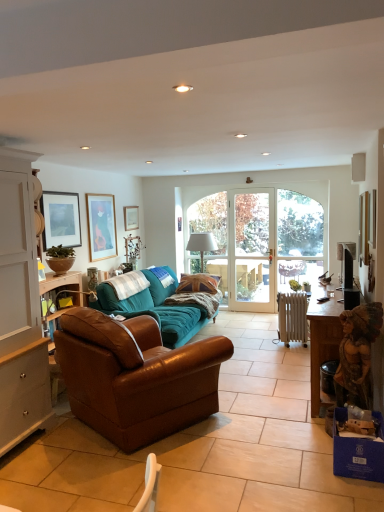
You are a GUI agent. You are given a task and a screenshot of the screen. Output one action in this format:
    pyautogui.click(x=<x>, y=<y>)
    Task: Click on the vacant area located to the right-hand side of brown leather couch at center, which is the 1th studio couch from front to back
    
    Given the screenshot: What is the action you would take?
    pyautogui.click(x=265, y=414)